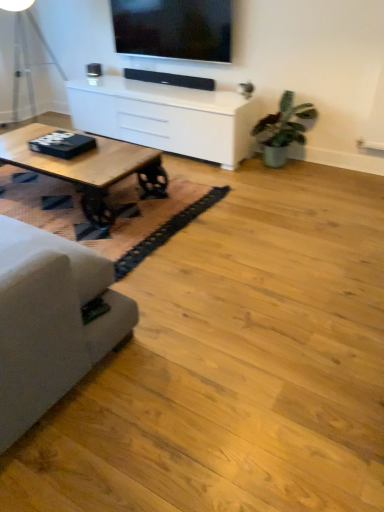
The image size is (384, 512). In order to click on vacant area that is in front of green matte plant at right in this screenshot , I will do coord(284,185).